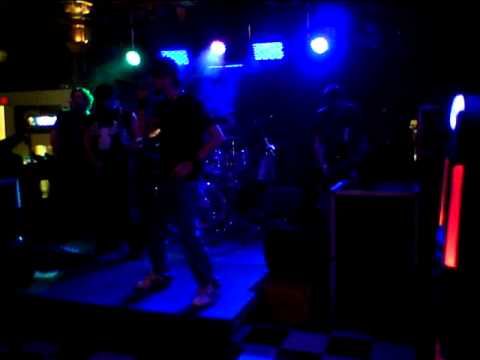
Locate an element on the screen. The image size is (480, 360). floor is located at coordinates click(x=352, y=341).